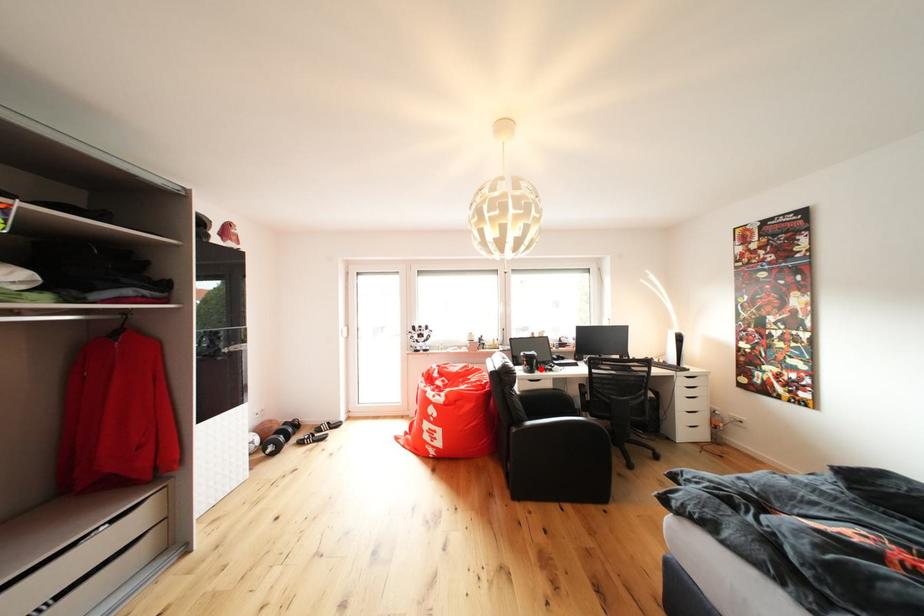
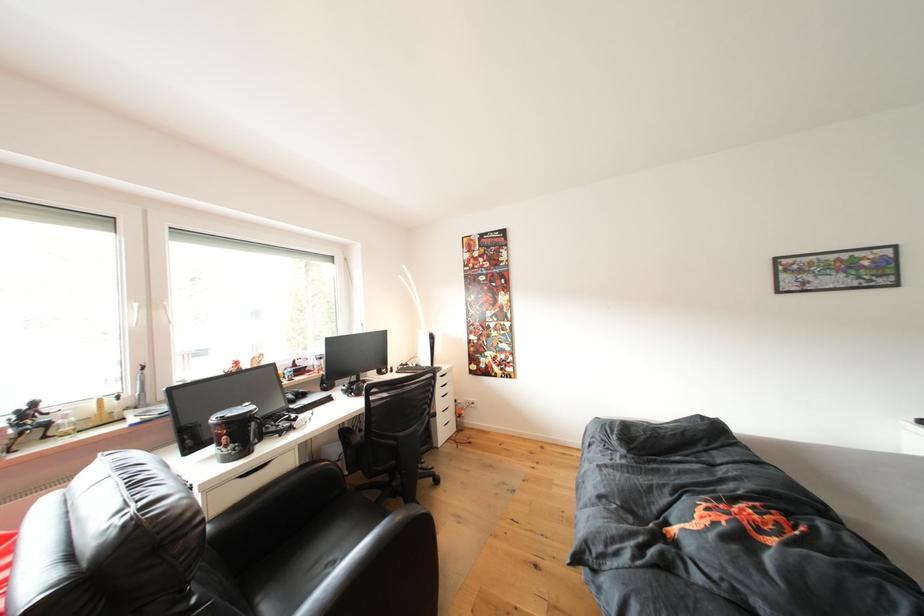
Locate, in the second image, the point that corresponds to the highlighted location in the first image.

(253, 440)